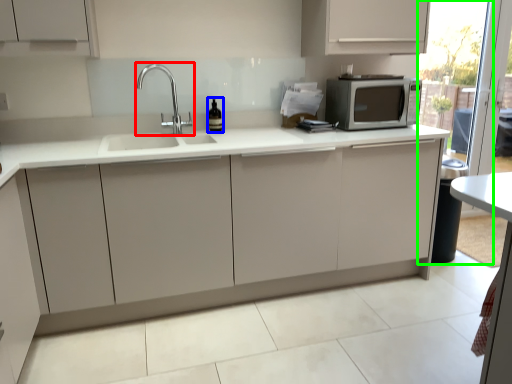
Question: Considering the real-world distances, which object is farthest from tap (highlighted by a red box)? wine bottle (highlighted by a blue box) or screen door (highlighted by a green box)?

Choices:
 (A) wine bottle
 (B) screen door

Answer: (B)